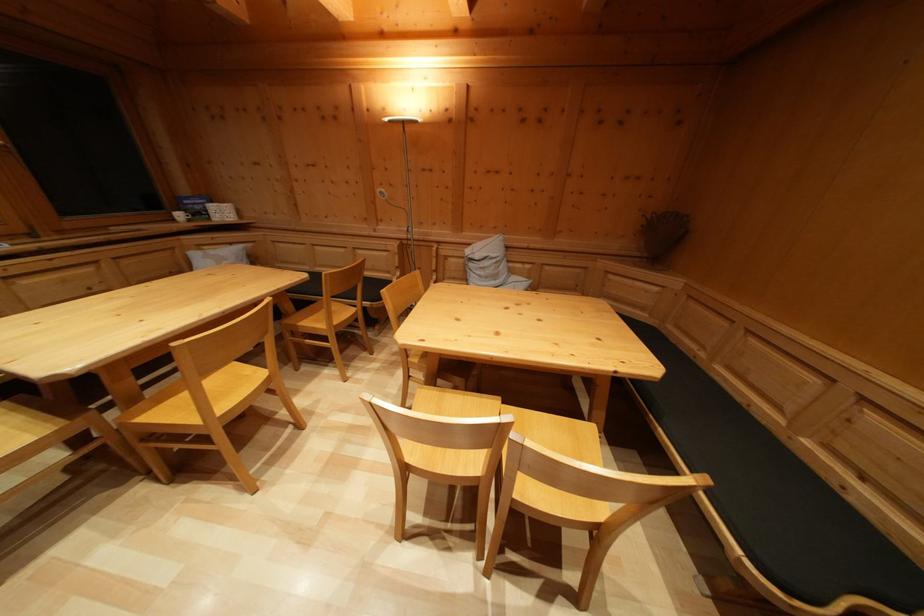
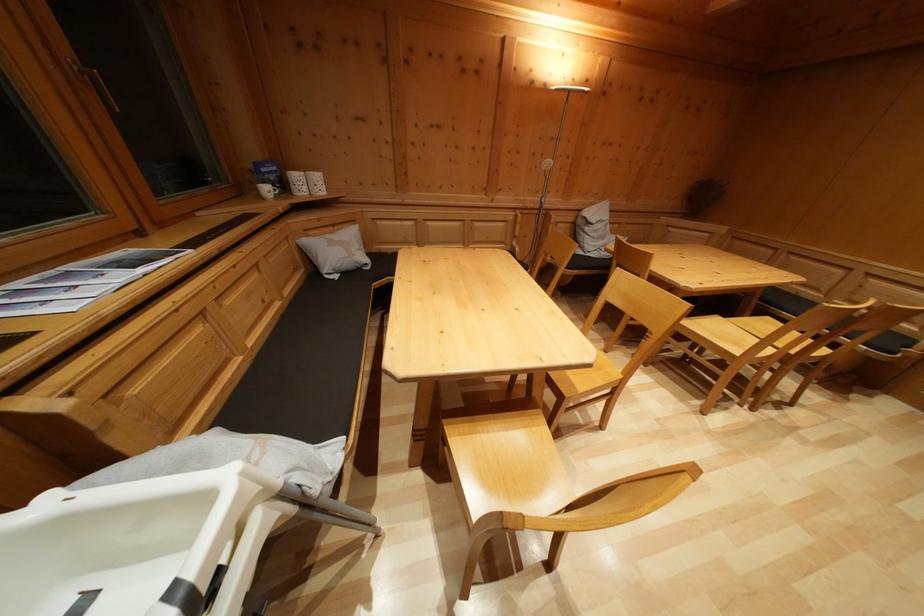
Question: The images are taken continuously from a first-person perspective. In which direction are you moving?

Choices:
 (A) Left
 (B) Right
 (C) Forward
 (D) Backward

Answer: (A)